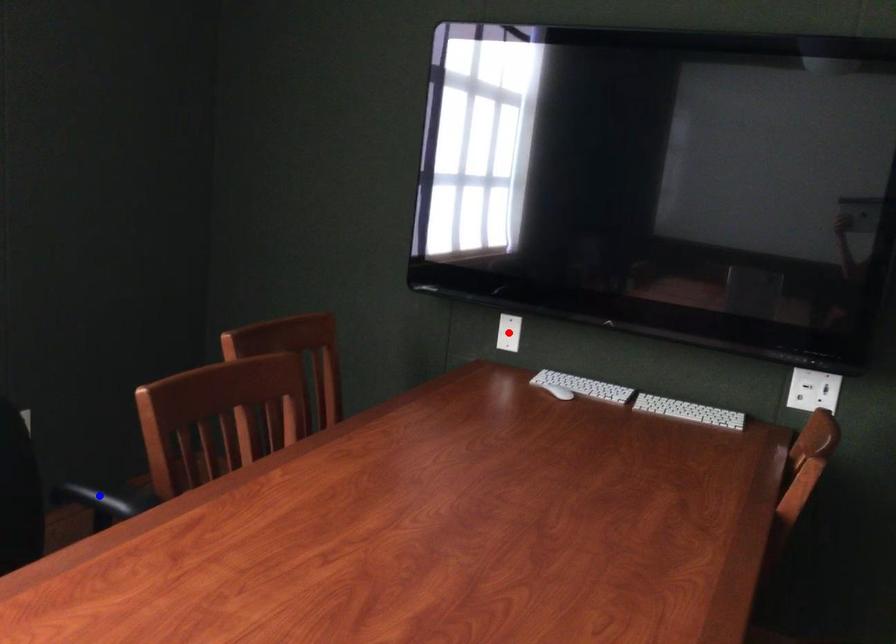
Question: Two points are marked on the image. Which point is closer to the camera?

Choices:
 (A) Blue point is closer.
 (B) Red point is closer.

Answer: (A)